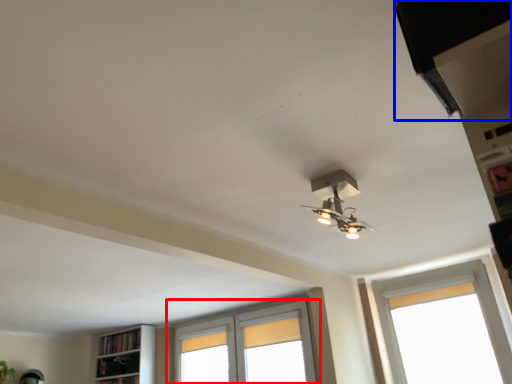
Question: Which object is further to the camera taking this photo, window (highlighted by a red box) or exhaust hood (highlighted by a blue box)?

Choices:
 (A) window
 (B) exhaust hood

Answer: (A)